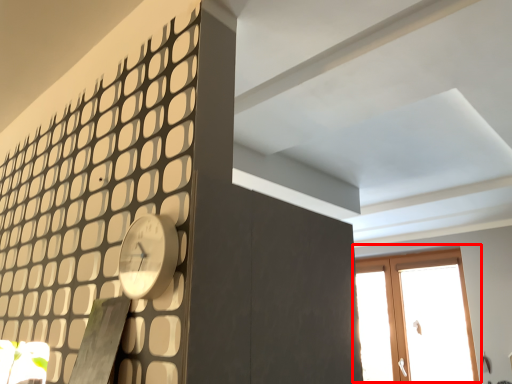
Question: In this image, where is window (annotated by the red box) located relative to clock?

Choices:
 (A) left
 (B) right

Answer: (B)